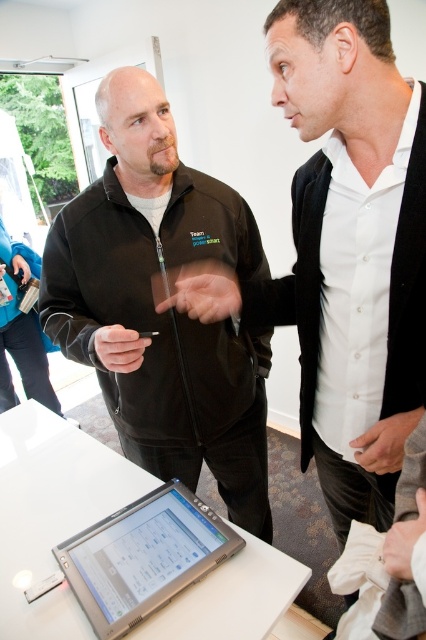
Question: Which object is farther from the camera taking this photo?

Choices:
 (A) black plastic cigarette at center
 (B) black zip-up jacket at center
 (C) silver metallic laptop at lower center
 (D) white glossy table at lower center

Answer: (A)

Question: In this image, where is black zip-up jacket at center located relative to silver metallic laptop at lower center?

Choices:
 (A) below
 (B) above

Answer: (B)

Question: Which of the following is the closest to the observer?

Choices:
 (A) (143, 333)
 (B) (238, 492)

Answer: (A)

Question: Which point is closer to the camera taking this photo?

Choices:
 (A) (150, 332)
 (B) (359, 278)
 (C) (126, 452)

Answer: (B)

Question: Is black zip-up jacket at center positioned before black plastic cigarette at center?

Choices:
 (A) no
 (B) yes

Answer: (B)

Question: Observing the image, what is the correct spatial positioning of black matte jacket at upper left in reference to silver metallic laptop at lower center?

Choices:
 (A) right
 (B) left

Answer: (A)